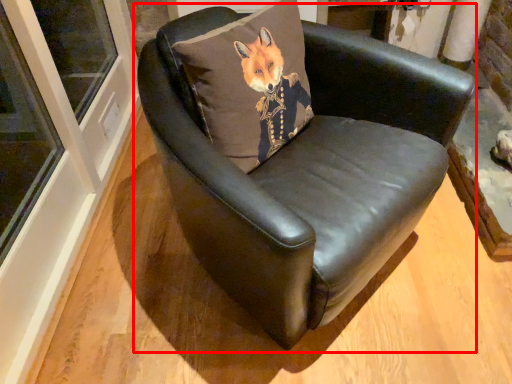
Question: From the image's perspective, where is chair (annotated by the red box) located in relation to pillow in the image?

Choices:
 (A) below
 (B) above

Answer: (A)